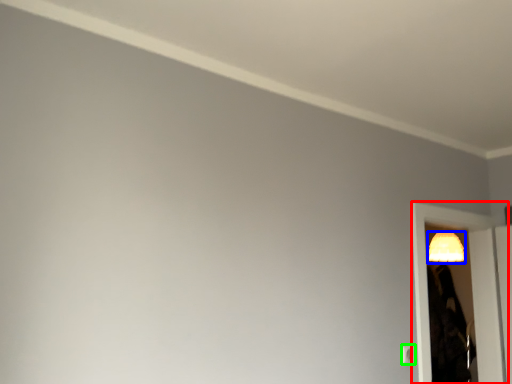
Question: Which object is the farthest from screen door (highlighted by a red box)? Choose among these: lamp (highlighted by a blue box) or light switch (highlighted by a green box).

Choices:
 (A) lamp
 (B) light switch

Answer: (B)